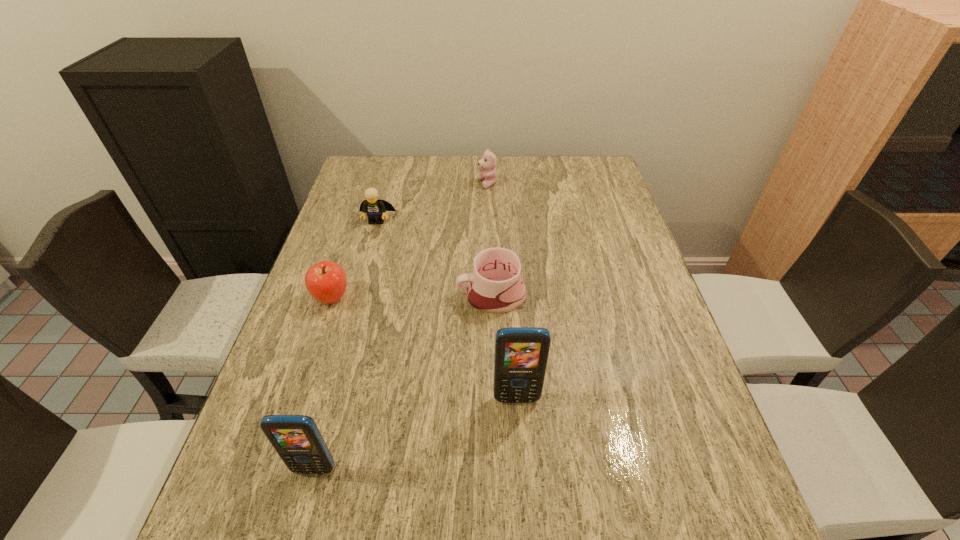
Find the location of a particular element. Image resolution: width=960 pixels, height=540 pixels. vacant region located 0.310m at the face of the farthest object is located at coordinates (385, 184).

Identify the location of vacant space situated at the face of the farthest object. [x=373, y=184].

Find the location of a particular element. blank area located 0.240m on the front-facing side of the second farthest object is located at coordinates click(359, 284).

At what (x,y) coordinates should I click in order to perform the action: click on vacant space located 0.230m on the side with the handle of the mug. Please return your answer as a coordinate pair (x, y). The height and width of the screenshot is (540, 960). Looking at the image, I should click on (366, 295).

Locate an element on the screen. blank space located 0.150m on the side with the handle of the mug is located at coordinates (397, 295).

Where is `vacant space located on the side with the handle of the mug`? vacant space located on the side with the handle of the mug is located at coordinates (425, 295).

What are the coordinates of `vacant space located on the back of the apple` in the screenshot? It's located at (356, 224).

Identify the location of object positioned at the far edge. (488, 162).

Image resolution: width=960 pixels, height=540 pixels. Find the location of `object that is at the near edge`. object that is at the near edge is located at coordinates (296, 438).

Locate an element on the screen. This screenshot has width=960, height=540. cellular telephone present at the left edge is located at coordinates (296, 438).